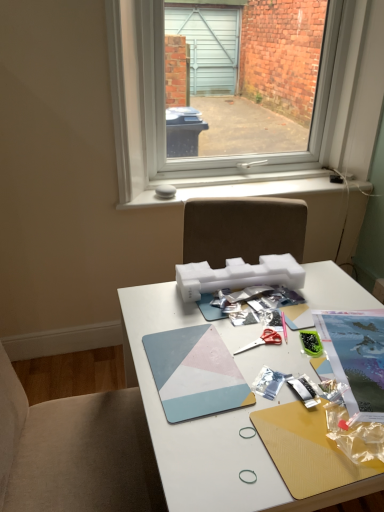
Question: From a real-world perspective, is red plastic scissors at center on top of transparent glass window at upper center?

Choices:
 (A) yes
 (B) no

Answer: (B)

Question: From the image's perspective, is red plastic scissors at center located beneath transparent glass window at upper center?

Choices:
 (A) yes
 (B) no

Answer: (A)

Question: Is red plastic scissors at center oriented towards transparent glass window at upper center?

Choices:
 (A) no
 (B) yes

Answer: (A)

Question: Is red plastic scissors at center positioned far away from transparent glass window at upper center?

Choices:
 (A) yes
 (B) no

Answer: (A)

Question: Can you confirm if red plastic scissors at center is shorter than transparent glass window at upper center?

Choices:
 (A) yes
 (B) no

Answer: (A)

Question: From a real-world perspective, is transparent glass window at upper center positioned above or below green plastic container at center-right?

Choices:
 (A) above
 (B) below

Answer: (A)

Question: Is transparent glass window at upper center taller or shorter than green plastic container at center-right?

Choices:
 (A) tall
 (B) short

Answer: (A)

Question: Would you say transparent glass window at upper center is inside or outside green plastic container at center-right?

Choices:
 (A) inside
 (B) outside

Answer: (B)

Question: Considering their positions, is transparent glass window at upper center located in front of or behind green plastic container at center-right?

Choices:
 (A) front
 (B) behind

Answer: (B)

Question: Is red plastic scissors at center spatially inside printed paper magazine at center right, the second magazine when ordered from left to right, or outside of it?

Choices:
 (A) inside
 (B) outside

Answer: (B)

Question: From their relative heights in the image, would you say red plastic scissors at center is taller or shorter than printed paper magazine at center right, the first magazine positioned from the right?

Choices:
 (A) tall
 (B) short

Answer: (B)

Question: Visually, is red plastic scissors at center positioned to the left or to the right of printed paper magazine at center right, the second magazine when ordered from left to right?

Choices:
 (A) right
 (B) left

Answer: (B)

Question: Is red plastic scissors at center in front of or behind printed paper magazine at center right, the first magazine positioned from the right, in the image?

Choices:
 (A) behind
 (B) front

Answer: (A)

Question: Is geometric matte mousepad at center, acting as the 2th magazine starting from the right, bigger or smaller than transparent glass window at upper center?

Choices:
 (A) big
 (B) small

Answer: (B)

Question: In terms of height, does geometric matte mousepad at center, positioned as the first magazine in left-to-right order, look taller or shorter compared to transparent glass window at upper center?

Choices:
 (A) tall
 (B) short

Answer: (B)